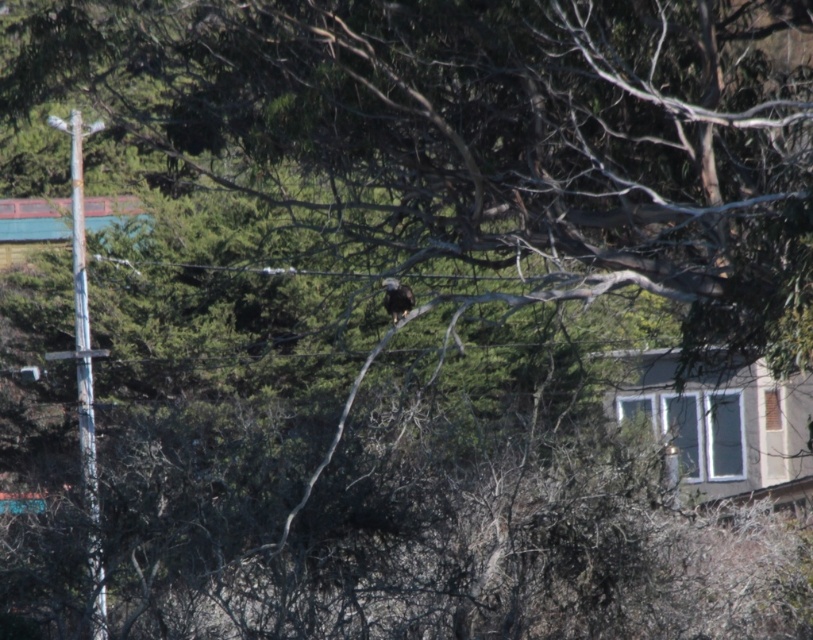
Between rusty metal pole at left and dark brown feathers at center, which one has more height?

rusty metal pole at left

Image resolution: width=813 pixels, height=640 pixels. Describe the element at coordinates (85, 369) in the screenshot. I see `rusty metal pole at left` at that location.

This screenshot has height=640, width=813. Find the location of `rusty metal pole at left`. rusty metal pole at left is located at coordinates (85, 369).